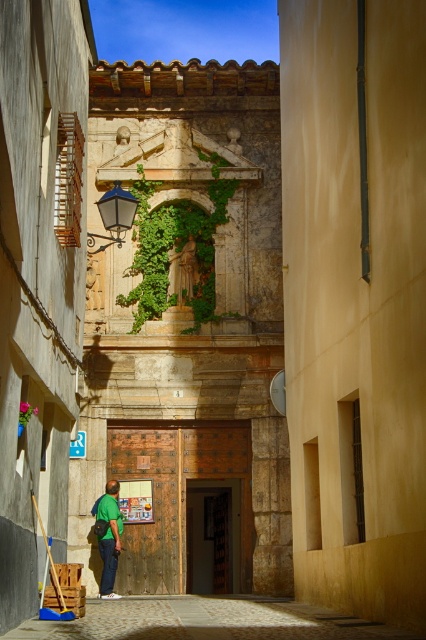
Can you confirm if cobblestone pavement at center is taller than green fabric shirt at lower left?

Correct, cobblestone pavement at center is much taller as green fabric shirt at lower left.

Who is more distant from viewer, [146,628] or [100,500]?

Point [100,500]

Where is `cobblestone pavement at center`? This screenshot has width=426, height=640. cobblestone pavement at center is located at coordinates (206, 620).

Where is `cobblestone pavement at center`? Image resolution: width=426 pixels, height=640 pixels. cobblestone pavement at center is located at coordinates (206, 620).

Who is more forward, (x=34, y=621) or (x=158, y=264)?

Positioned in front is point (x=34, y=621).

Describe the element at coordinates (206, 620) in the screenshot. The image size is (426, 640). I see `cobblestone pavement at center` at that location.

The image size is (426, 640). In order to click on cobblestone pavement at center in this screenshot , I will do `click(206, 620)`.

Between green leafy ivy at center and green fabric shirt at lower left, which one appears on the right side from the viewer's perspective?

From the viewer's perspective, green leafy ivy at center appears more on the right side.

Describe the element at coordinates (175, 248) in the screenshot. I see `green leafy ivy at center` at that location.

Find the location of a particular element. This screenshot has height=640, width=426. green leafy ivy at center is located at coordinates (175, 248).